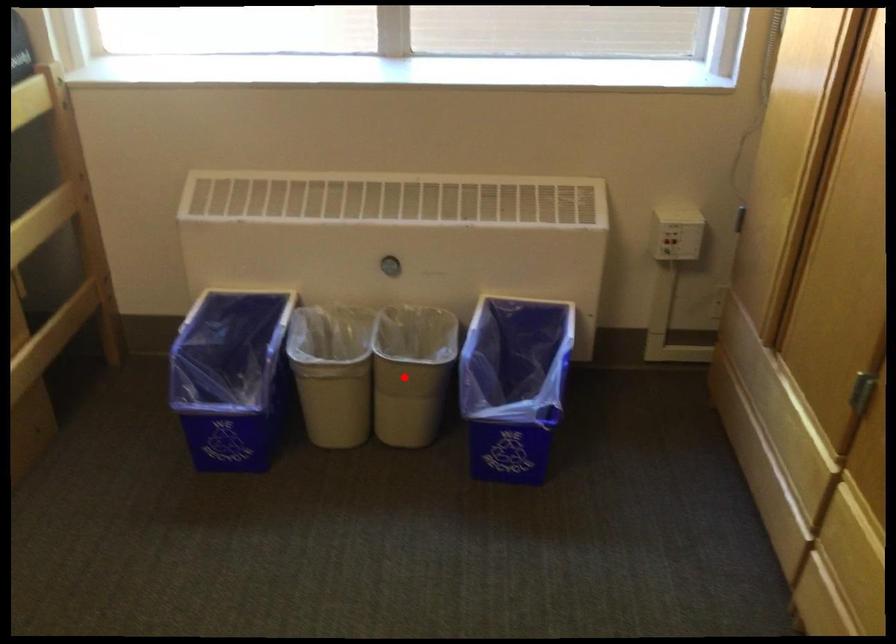
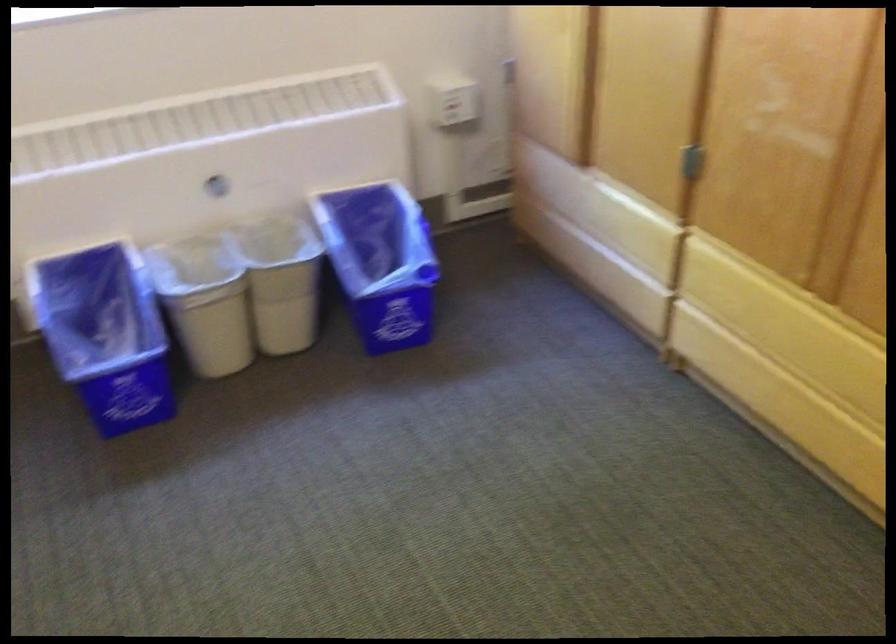
Where in the second image is the point corresponding to the highlighted location from the first image?

(281, 281)